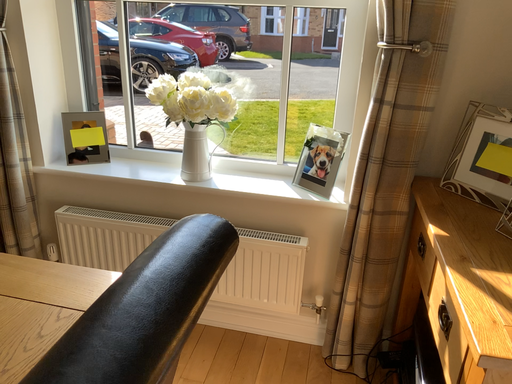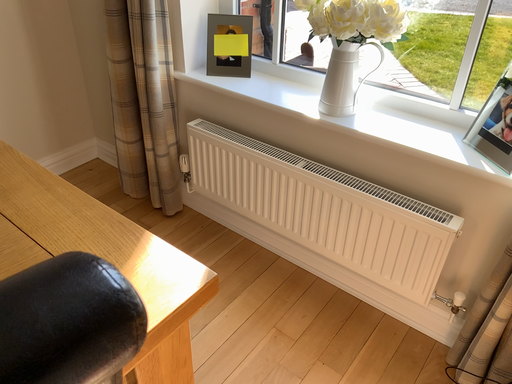
Question: Which way did the camera rotate in the video?

Choices:
 (A) rotated right
 (B) rotated left

Answer: (B)